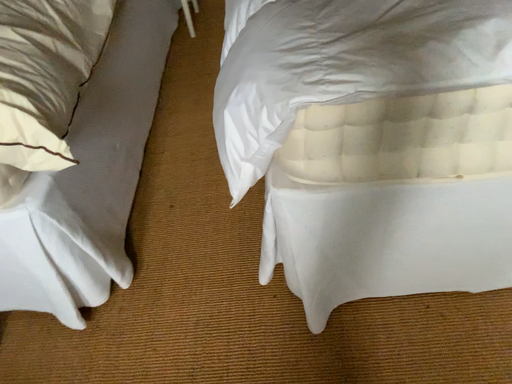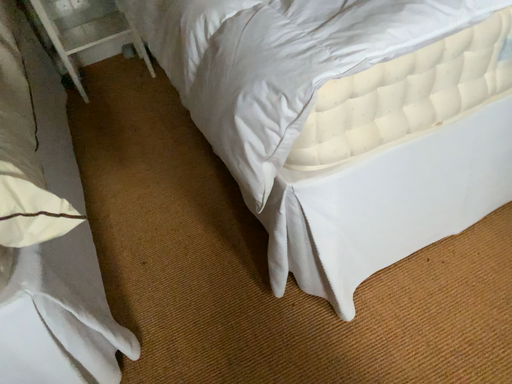
Question: How did the camera likely rotate when shooting the video?

Choices:
 (A) rotated left
 (B) rotated right

Answer: (B)